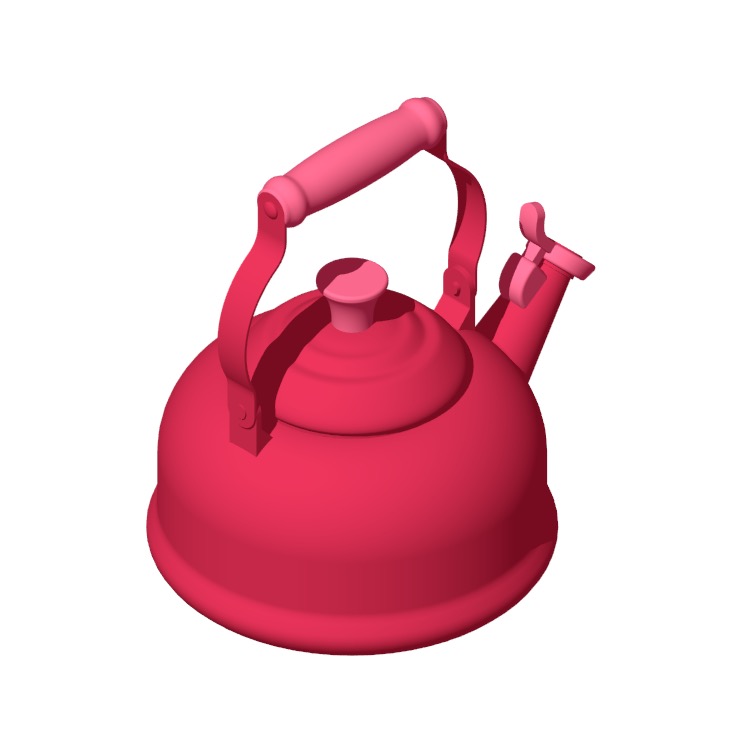
The width and height of the screenshot is (750, 750). In order to click on knob in this screenshot , I will do `click(364, 314)`.